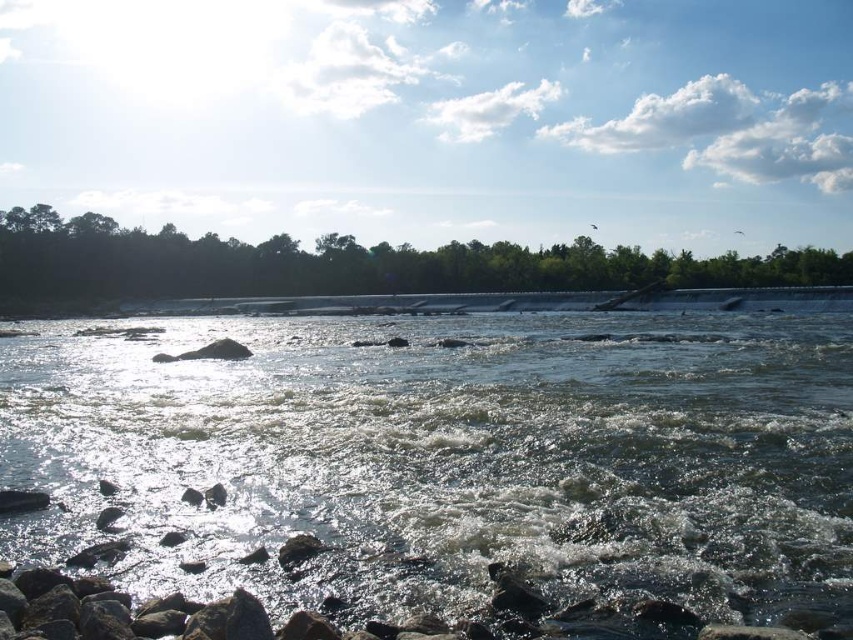
You are standing on the rocky shoreline and want to cross to the other side of the river. The greenish water at center is 6.45 meters away from you. If your maximum jumping distance is 6 meters, can you safely jump across the river to reach the other side?

The greenish water at center is 6.45 meters away, which exceeds your maximum jumping distance of 6 meters. Therefore, you cannot safely jump across the river to reach the other side.

You are standing at the point marked as point (631, 280) and want to reach the point marked as point (248, 362). Which direction should you move to get there?

You should move forward because point (248, 362) is in front of point (631, 280).